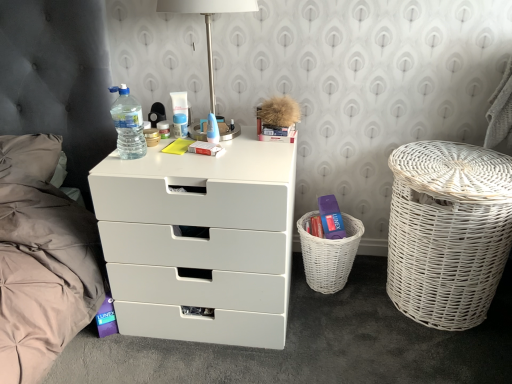
Image resolution: width=512 pixels, height=384 pixels. In order to click on free space between white wicker basket at lower right and white wicker laundry basket at right in this screenshot , I will do `click(351, 299)`.